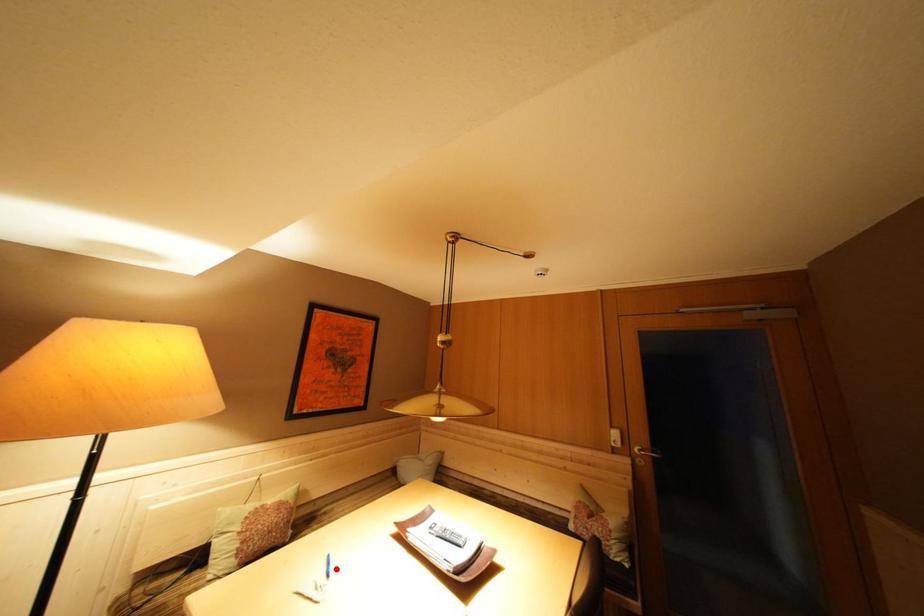
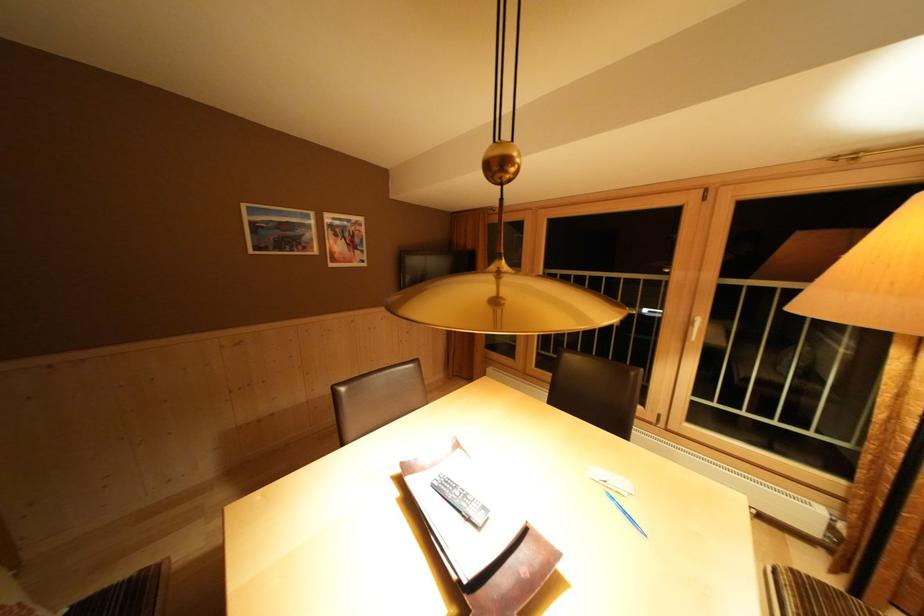
The point at the highlighted location is marked in the first image. Where is the corresponding point in the second image?

(633, 517)